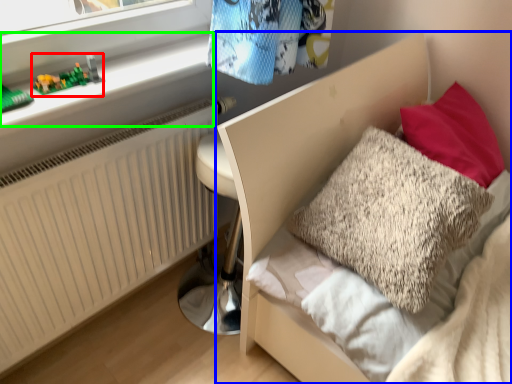
Question: Which object is positioned farthest from toy (highlighted by a red box)? Select from bed (highlighted by a blue box) and window sill (highlighted by a green box).

Choices:
 (A) bed
 (B) window sill

Answer: (A)